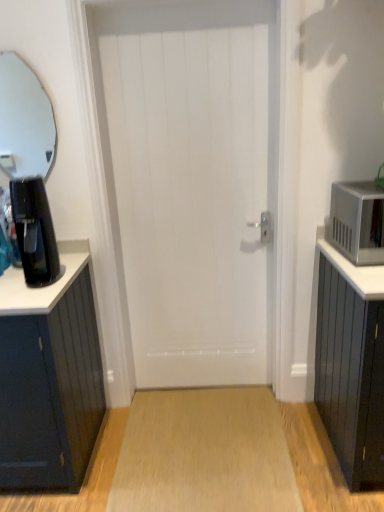
This screenshot has height=512, width=384. Identify the location of clear glass mirror at upper left. (24, 121).

The image size is (384, 512). What do you see at coordinates (34, 231) in the screenshot? I see `black plastic coffee maker at left` at bounding box center [34, 231].

The height and width of the screenshot is (512, 384). Identify the location of satin silver microwave at right. (358, 222).

Is light brown wood floor at center aimed at clear glass mirror at upper left?

No, light brown wood floor at center does not turn towards clear glass mirror at upper left.

Between light brown wood floor at center and clear glass mirror at upper left, which one has larger size?

With larger size is light brown wood floor at center.

Do you think light brown wood floor at center is within clear glass mirror at upper left, or outside of it?

light brown wood floor at center is outside clear glass mirror at upper left.

In the scene shown: Would you consider light brown wood floor at center to be distant from clear glass mirror at upper left?

Yes.

Could you tell me if white wooden door at center is facing clear glass mirror at upper left?

No, white wooden door at center does not turn towards clear glass mirror at upper left.

Between white wooden door at center and clear glass mirror at upper left, which one is positioned in front?

white wooden door at center is more forward.

From a real-world perspective, between clear glass mirror at upper left and light brown wood floor at center, who is vertically higher?

clear glass mirror at upper left is physically above.

Is clear glass mirror at upper left looking in the opposite direction of light brown wood floor at center?

No, clear glass mirror at upper left's orientation is not away from light brown wood floor at center.

Between clear glass mirror at upper left and light brown wood floor at center, which one has larger width?

With larger width is light brown wood floor at center.

Is light brown wood floor at center a part of clear glass mirror at upper left?

That's incorrect, light brown wood floor at center is not inside clear glass mirror at upper left.

Is satin silver microwave at right next to black plastic coffee maker at left?

No.

From a real-world perspective, is satin silver microwave at right physically located above or below black plastic coffee maker at left?

satin silver microwave at right is situated lower than black plastic coffee maker at left in the real world.

Is satin silver microwave at right wider than black plastic coffee maker at left?

Correct, the width of satin silver microwave at right exceeds that of black plastic coffee maker at left.

Who is smaller, satin silver microwave at right or black plastic coffee maker at left?

black plastic coffee maker at left is smaller.

Do you think satin silver microwave at right is within white wooden door at center, or outside of it?

satin silver microwave at right is outside white wooden door at center.

Considering the sizes of objects satin silver microwave at right and white wooden door at center in the image provided, who is shorter, satin silver microwave at right or white wooden door at center?

With less height is satin silver microwave at right.

Is satin silver microwave at right facing towards white wooden door at center?

No, satin silver microwave at right is not facing towards white wooden door at center.

Considering the relative sizes of satin silver microwave at right and white wooden door at center in the image provided, is satin silver microwave at right thinner than white wooden door at center?

No, satin silver microwave at right is not thinner than white wooden door at center.

From the image's perspective, which is above, black plastic coffee maker at left or light brown wood floor at center?

black plastic coffee maker at left appears higher in the image.

Considering the relative positions of black plastic coffee maker at left and light brown wood floor at center in the image provided, is black plastic coffee maker at left to the right of light brown wood floor at center from the viewer's perspective?

No.

Is black plastic coffee maker at left positioned with its back to light brown wood floor at center?

No, light brown wood floor at center is not at the back of black plastic coffee maker at left.

Is black plastic coffee maker at left wider or thinner than light brown wood floor at center?

Clearly, black plastic coffee maker at left has less width compared to light brown wood floor at center.

Are white wooden door at center and black plastic coffee maker at left making contact?

There is a gap between white wooden door at center and black plastic coffee maker at left.

Which is nearer, (170, 76) or (21, 245)?

The point (21, 245) is closer to the camera.

Is black plastic coffee maker at left at the back of white wooden door at center?

No, black plastic coffee maker at left is not at the back of white wooden door at center.

Can you confirm if white wooden door at center is taller than black plastic coffee maker at left?

Yes.

This screenshot has width=384, height=512. I want to click on mirror above the light brown wood floor at center (from the image's perspective), so click(24, 121).

I want to click on door on the right of clear glass mirror at upper left, so click(x=193, y=183).

When comparing their distances from light brown wood floor at center, does satin silver microwave at right or black plastic coffee maker at left seem further?

Among the two, satin silver microwave at right is located further to light brown wood floor at center.

Based on the photo, based on their spatial positions, is clear glass mirror at upper left or black plastic coffee maker at left closer to satin silver microwave at right?

Based on the image, black plastic coffee maker at left appears to be nearer to satin silver microwave at right.

Looking at this image, estimate the real-world distances between objects in this image. Which object is closer to satin silver microwave at right, white wooden door at center or black plastic coffee maker at left?

white wooden door at center is closer to satin silver microwave at right.

Looking at the image, which one is located closer to clear glass mirror at upper left, satin silver microwave at right or white wooden door at center?

The object closer to clear glass mirror at upper left is white wooden door at center.

When comparing their distances from clear glass mirror at upper left, does light brown wood floor at center or white wooden door at center seem further?

light brown wood floor at center is further to clear glass mirror at upper left.

From the image, which object appears to be nearer to black plastic coffee maker at left, white wooden door at center or satin silver microwave at right?

white wooden door at center lies closer to black plastic coffee maker at left than the other object.

Which object lies further to the anchor point clear glass mirror at upper left, light brown wood floor at center or black plastic coffee maker at left?

Based on the image, light brown wood floor at center appears to be further to clear glass mirror at upper left.

Estimate the real-world distances between objects in this image. Which object is closer to light brown wood floor at center, white wooden door at center or black plastic coffee maker at left?

white wooden door at center lies closer to light brown wood floor at center than the other object.

This screenshot has width=384, height=512. In order to click on coffee maker between clear glass mirror at upper left and white wooden door at center in this screenshot , I will do click(34, 231).

You are a GUI agent. You are given a task and a screenshot of the screen. Output one action in this format:
    pyautogui.click(x=<x>, y=<y>)
    Task: Click on the coffee maker that lies between white wooden door at center and light brown wood floor at center from top to bottom
    The height and width of the screenshot is (512, 384).
    Given the screenshot: What is the action you would take?
    pyautogui.click(x=34, y=231)

In order to click on door between clear glass mirror at upper left and light brown wood floor at center in the vertical direction in this screenshot , I will do pos(193,183).

The height and width of the screenshot is (512, 384). In order to click on microwave oven between clear glass mirror at upper left and light brown wood floor at center in the up-down direction in this screenshot , I will do `click(358, 222)`.